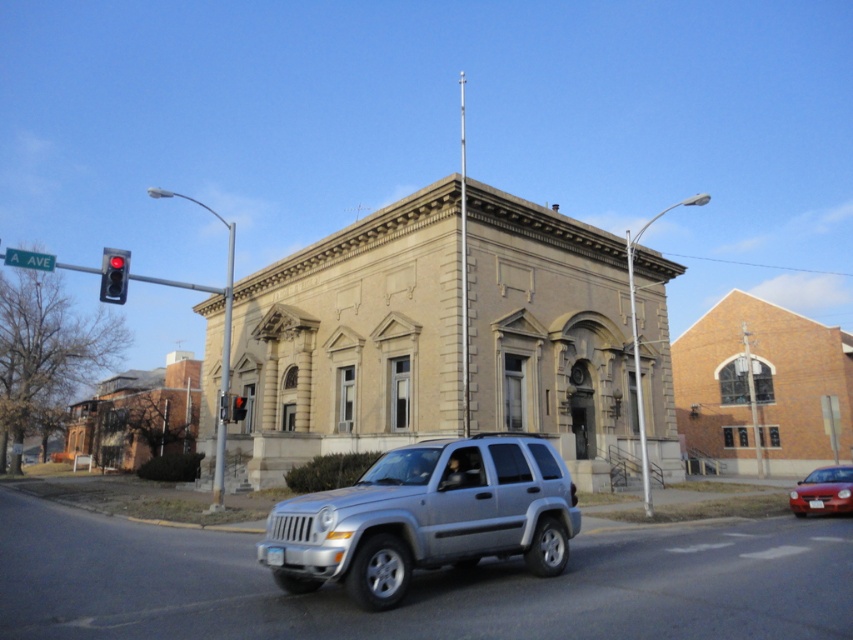
You are standing on the sidewalk next to the crosswalk in front of the historical building. You see a silver Jeep SUV driving past and a point marked at coordinates (114,275). What object does this point correspond to?

The point corresponds to the red glass traffic light at left.

You are standing at the crosswalk and see the traffic light pole on the left side of the frame. There is a point labeled as point [822,492]. What object does this point correspond to?

The point [822,492] corresponds to the shiny red sedan at lower right.